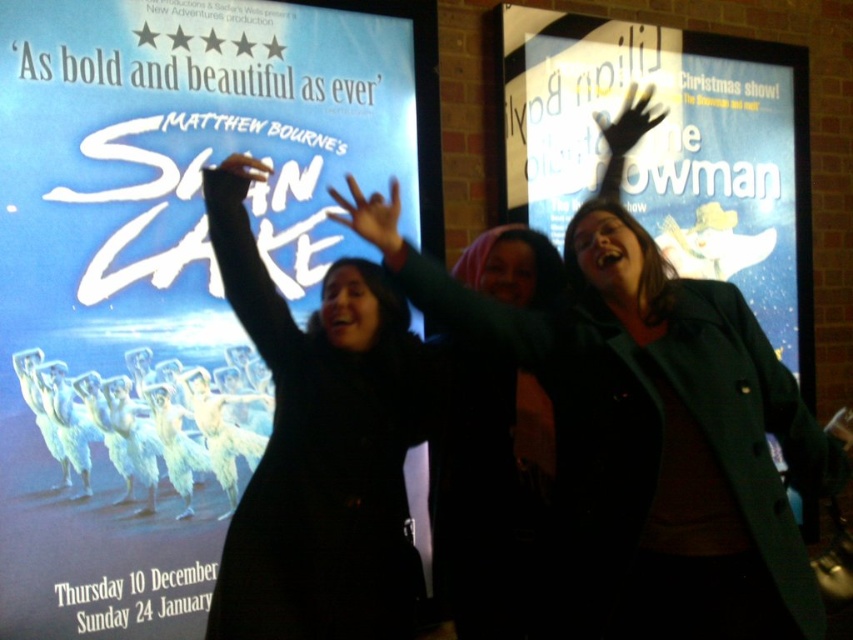
Question: Does teal fabric coat at center come in front of black matte phone at upper left?

Choices:
 (A) yes
 (B) no

Answer: (A)

Question: Which is farther from the matte black hand at upper center?

Choices:
 (A) black matte coat at center
 (B) matte black coat at center
 (C) matte black poster at left
 (D) black matte phone at upper left

Answer: (C)

Question: Is matte blue snowman at upper right wider than black matte phone at upper left?

Choices:
 (A) no
 (B) yes

Answer: (B)

Question: Estimate the real-world distances between objects in this image. Which object is closer to the teal fabric coat at center?

Choices:
 (A) matte blue snowman at upper right
 (B) matte black poster at left

Answer: (B)

Question: Which point is closer to the camera?

Choices:
 (A) (665, 260)
 (B) (126, 227)
 (C) (390, 253)
 (D) (653, 88)

Answer: (C)

Question: From the image, what is the correct spatial relationship of teal fabric coat at center in relation to matte blue snowman at upper right?

Choices:
 (A) left
 (B) right

Answer: (A)